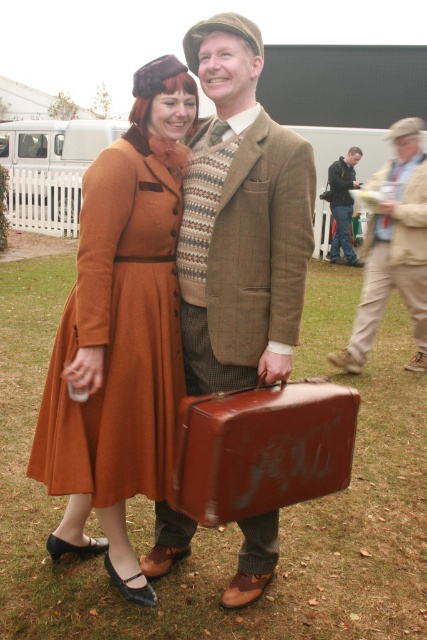
Question: Does matte brown suitcase at center come in front of dark blue leather jacket at center?

Choices:
 (A) no
 (B) yes

Answer: (B)

Question: Which point is farther to the camera?

Choices:
 (A) (389, 134)
 (B) (227, 49)
 (C) (278, 438)
 (D) (163, 496)

Answer: (A)

Question: Can you confirm if matte brown suitcase at center is wider than dark blue leather jacket at center?

Choices:
 (A) yes
 (B) no

Answer: (A)

Question: Which point appears farthest from the camera in this image?

Choices:
 (A) (219, 490)
 (B) (412, 208)
 (C) (353, 180)
 (D) (202, 60)

Answer: (C)

Question: Which of the following is the farthest from the observer?

Choices:
 (A) beige woolen suit at center
 (B) dark blue leather jacket at center

Answer: (B)

Question: Where is matte brown suit at center located in relation to dark blue leather jacket at center in the image?

Choices:
 (A) above
 (B) below

Answer: (B)